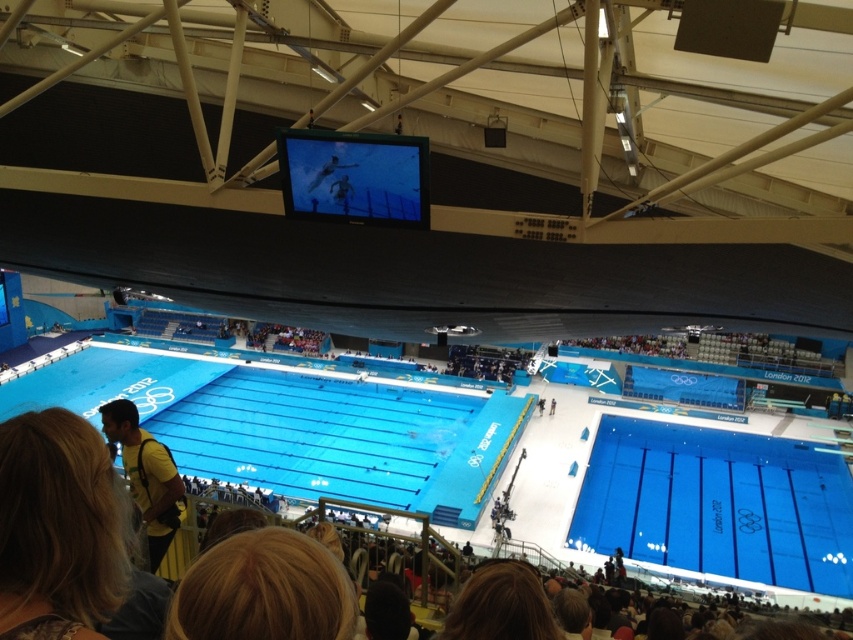
Between point (235, 394) and point (598, 436), which one is positioned in front?

Positioned in front is point (598, 436).

Based on the photo, who is positioned more to the right, blue smooth water at center or brown hair at lower center?

brown hair at lower center is more to the right.

Describe the element at coordinates (297, 428) in the screenshot. The image size is (853, 640). I see `blue smooth water at center` at that location.

Where is `blue smooth water at center`? The width and height of the screenshot is (853, 640). blue smooth water at center is located at coordinates (297, 428).

Between blue smooth pool at lower right and yellow fabric backpack at lower left, which one is positioned lower?

blue smooth pool at lower right

The width and height of the screenshot is (853, 640). What are the coordinates of `blue smooth pool at lower right` in the screenshot? It's located at (718, 502).

Is point (730, 445) closer to viewer compared to point (126, 426)?

No, (730, 445) is behind (126, 426).

Who is more forward, (776, 440) or (126, 420)?

Point (126, 420) is more forward.

The width and height of the screenshot is (853, 640). Identify the location of brown hair at lower center. (717, 504).